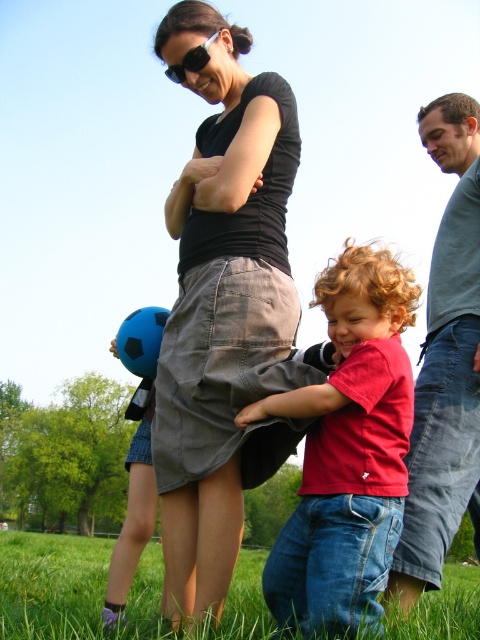
Does denim jeans at right appear on the right side of black plastic sunglasses at upper center?

Yes, denim jeans at right is to the right of black plastic sunglasses at upper center.

Who is more distant from viewer, [432,268] or [204,54]?

The point [432,268] is more distant.

Find the location of a particular element. Image resolution: width=480 pixels, height=640 pixels. denim jeans at right is located at coordinates (445, 364).

Measure the distance between matte red shirt at center and camera.

matte red shirt at center is 2.56 meters from camera.

Who is more forward, (369,490) or (17,556)?

Point (369,490) is more forward.

Where is `matte red shirt at center`? This screenshot has height=640, width=480. matte red shirt at center is located at coordinates (348, 451).

Can you confirm if matte black shirt at center is positioned below green grass at lower center?

No, matte black shirt at center is not below green grass at lower center.

Which is behind, point (288, 314) or point (415, 611)?

The point (288, 314) is behind.

This screenshot has height=640, width=480. Find the location of `matte black shirt at center`. matte black shirt at center is located at coordinates (224, 310).